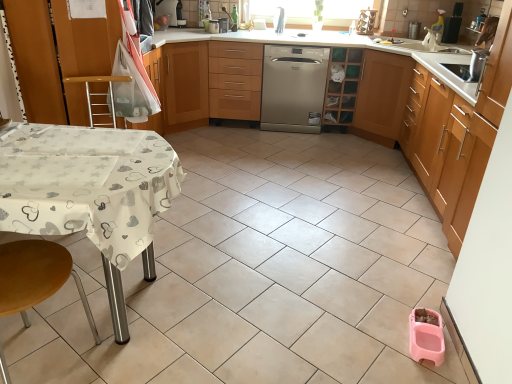
Describe the element at coordinates (98, 94) in the screenshot. The width and height of the screenshot is (512, 384). I see `wooden/metallic step stool at left, marked as the second step stool in a bottom-to-top arrangement` at that location.

Identify the location of white fabric-covered table at lower left. (x=90, y=193).

Find the location of a particular element. The height and width of the screenshot is (384, 512). brushed metal coffee machine at upper center, the first appliance positioned from the left is located at coordinates (168, 11).

This screenshot has height=384, width=512. Describe the element at coordinates (168, 11) in the screenshot. I see `brushed metal coffee machine at upper center, the first appliance positioned from the left` at that location.

You are a GUI agent. You are given a task and a screenshot of the screen. Output one action in this format:
    pyautogui.click(x=<x>, y=<y>)
    Task: Click on the wooden drawer at center
    The height and width of the screenshot is (384, 512).
    Given the screenshot: What is the action you would take?
    pyautogui.click(x=234, y=80)

Is metallic silver toaster at upper center, which appears as the 2th appliance when viewed from the right, smaller than brushed metal coffee machine at upper center, the first appliance positioned from the left?

Yes, metallic silver toaster at upper center, which appears as the 2th appliance when viewed from the right, is smaller than brushed metal coffee machine at upper center, the first appliance positioned from the left.

Who is taller, metallic silver toaster at upper center, the second appliance positioned from the left, or brushed metal coffee machine at upper center, the first appliance positioned from the left?

brushed metal coffee machine at upper center, the first appliance positioned from the left, is taller.

From the image's perspective, count 2nd appliances upward from the metallic silver toaster at upper center, which appears as the 2th appliance when viewed from the right, and point to it. Please provide its 2D coordinates.

[(168, 11)]

Is wooden cabinet at center, the 3th cabinetry when ordered from left to right, spatially inside metallic silver toaster at upper center, the second appliance positioned from the left, or outside of it?

wooden cabinet at center, the 3th cabinetry when ordered from left to right, is spatially situated outside metallic silver toaster at upper center, the second appliance positioned from the left.

Looking at this image, is wooden cabinet at center, the 3th cabinetry when ordered from left to right, oriented towards metallic silver toaster at upper center, the second appliance positioned from the left?

No, wooden cabinet at center, the 3th cabinetry when ordered from left to right, does not turn towards metallic silver toaster at upper center, the second appliance positioned from the left.

From a real-world perspective, is wooden cabinet at center, arranged as the 2th cabinetry when viewed from the right, positioned above or below metallic silver toaster at upper center, which appears as the 2th appliance when viewed from the right?

Clearly, from a real-world perspective, wooden cabinet at center, arranged as the 2th cabinetry when viewed from the right, is below metallic silver toaster at upper center, which appears as the 2th appliance when viewed from the right.

Measure the distance from wooden cabinet at center, the 3th cabinetry when ordered from left to right, to metallic silver toaster at upper center, which appears as the 2th appliance when viewed from the right.

wooden cabinet at center, the 3th cabinetry when ordered from left to right, is 4.33 feet from metallic silver toaster at upper center, which appears as the 2th appliance when viewed from the right.

Is white fabric-covered table at lower left closer to the viewer compared to wooden drawer at center?

Yes, white fabric-covered table at lower left is in front of wooden drawer at center.

From a real-world perspective, between white fabric-covered table at lower left and wooden drawer at center, who is vertically higher?

From a 3D spatial view, wooden drawer at center is above.

Could you tell me if white fabric-covered table at lower left is facing wooden drawer at center?

No.

From a real-world perspective, does wooden cabinet at upper center, the 2th cabinetry when ordered from left to right, stand above white fabric-covered table at lower left?

Yes, from a real-world perspective, wooden cabinet at upper center, the 2th cabinetry when ordered from left to right, is over white fabric-covered table at lower left

Which object is wider, wooden cabinet at upper center, the third cabinetry positioned from the right, or white fabric-covered table at lower left?

wooden cabinet at upper center, the third cabinetry positioned from the right, is wider.

Is the depth of wooden cabinet at upper center, the third cabinetry positioned from the right, greater than that of white fabric-covered table at lower left?

Yes, the depth of wooden cabinet at upper center, the third cabinetry positioned from the right, is greater than that of white fabric-covered table at lower left.

Is wooden cabinet at upper center, the 2th cabinetry when ordered from left to right, turned away from white fabric-covered table at lower left?

No.

From the picture: Considering the sizes of objects metallic silver spice rack at upper center, marked as the third appliance in a left-to-right arrangement, and light brown wood cabinet at right, placed as the 4th cabinetry when sorted from left to right, in the image provided, who is wider, metallic silver spice rack at upper center, marked as the third appliance in a left-to-right arrangement, or light brown wood cabinet at right, placed as the 4th cabinetry when sorted from left to right,?

light brown wood cabinet at right, placed as the 4th cabinetry when sorted from left to right, is wider.

Is metallic silver spice rack at upper center, marked as the third appliance in a left-to-right arrangement, situated inside light brown wood cabinet at right, placed as the 4th cabinetry when sorted from left to right, or outside?

metallic silver spice rack at upper center, marked as the third appliance in a left-to-right arrangement, is located beyond the bounds of light brown wood cabinet at right, placed as the 4th cabinetry when sorted from left to right.

Between metallic silver spice rack at upper center, the first appliance from the right, and light brown wood cabinet at right, marked as the first cabinetry in a right-to-left arrangement, which one has more height?

Standing taller between the two is light brown wood cabinet at right, marked as the first cabinetry in a right-to-left arrangement.

In the image, is metallic silver spice rack at upper center, marked as the third appliance in a left-to-right arrangement, on the left side or the right side of light brown wood cabinet at right, marked as the first cabinetry in a right-to-left arrangement?

metallic silver spice rack at upper center, marked as the third appliance in a left-to-right arrangement, is positioned on light brown wood cabinet at right, marked as the first cabinetry in a right-to-left arrangement,'s left side.

Is point (355, 85) positioned behind point (29, 26)?

Yes.

Considering the relative positions of wooden cabinet at center, arranged as the 2th cabinetry when viewed from the right, and white glossy table at left, the 4th cabinetry from the right, in the image provided, is wooden cabinet at center, arranged as the 2th cabinetry when viewed from the right, to the left of white glossy table at left, the 4th cabinetry from the right, from the viewer's perspective?

Incorrect, wooden cabinet at center, arranged as the 2th cabinetry when viewed from the right, is not on the left side of white glossy table at left, the 4th cabinetry from the right.

Where is `cabinetry above the wooden cabinet at center, arranged as the 2th cabinetry when viewed from the right (from a real-world perspective)`? The image size is (512, 384). cabinetry above the wooden cabinet at center, arranged as the 2th cabinetry when viewed from the right (from a real-world perspective) is located at coordinates (59, 55).

From a real-world perspective, is wooden cabinet at center, the 3th cabinetry when ordered from left to right, positioned under white glossy table at left, placed as the 1th cabinetry when sorted from left to right, based on gravity?

Indeed, from a real-world perspective, wooden cabinet at center, the 3th cabinetry when ordered from left to right, is positioned beneath white glossy table at left, placed as the 1th cabinetry when sorted from left to right.

Is metallic silver spice rack at upper center, marked as the third appliance in a left-to-right arrangement, situated inside brushed metal coffee machine at upper center, positioned as the 3th appliance in right-to-left order, or outside?

metallic silver spice rack at upper center, marked as the third appliance in a left-to-right arrangement, is spatially situated outside brushed metal coffee machine at upper center, positioned as the 3th appliance in right-to-left order.

Is brushed metal coffee machine at upper center, the first appliance positioned from the left, at the back of metallic silver spice rack at upper center, the first appliance from the right?

No, brushed metal coffee machine at upper center, the first appliance positioned from the left, is not at the back of metallic silver spice rack at upper center, the first appliance from the right.

Which of these two, metallic silver spice rack at upper center, marked as the third appliance in a left-to-right arrangement, or brushed metal coffee machine at upper center, positioned as the 3th appliance in right-to-left order, stands taller?

Standing taller between the two is brushed metal coffee machine at upper center, positioned as the 3th appliance in right-to-left order.

This screenshot has height=384, width=512. What are the coordinates of `appliance that is the 2nd object directly below the brushed metal coffee machine at upper center, positioned as the 3th appliance in right-to-left order (from a real-world perspective)` in the screenshot? It's located at (213, 26).

From the wooden cabinet at center, the 3th cabinetry when ordered from left to right, count the 1st appliance to the left and point to it. Please provide its 2D coordinates.

[(213, 26)]

Which object lies nearer to the anchor point white glossy table at left, the 4th cabinetry from the right, metallic silver spice rack at upper center, the first appliance from the right, or satin silver dishwasher at center?

satin silver dishwasher at center.

Looking at the image, which one is located further to metallic silver spice rack at upper center, the first appliance from the right, light brown wood cabinet at right, marked as the first cabinetry in a right-to-left arrangement, or white glossy table at left, the 4th cabinetry from the right?

white glossy table at left, the 4th cabinetry from the right, is further to metallic silver spice rack at upper center, the first appliance from the right.

Which object lies nearer to the anchor point wooden cabinet at upper center, the third cabinetry positioned from the right, wooden drawer at center or light brown wood cabinet at right, placed as the 4th cabinetry when sorted from left to right?

Based on the image, wooden drawer at center appears to be nearer to wooden cabinet at upper center, the third cabinetry positioned from the right.

Which object lies nearer to the anchor point brushed metal coffee machine at upper center, the first appliance positioned from the left, white glossy table at left, placed as the 1th cabinetry when sorted from left to right, or satin silver dishwasher at center?

satin silver dishwasher at center is closer to brushed metal coffee machine at upper center, the first appliance positioned from the left.

Based on their spatial positions, is white fabric-covered table at lower left or satin silver dishwasher at center further from wooden/metallic step stool at left, which ranks as the 1th step stool in top-to-bottom order?

Among the two, satin silver dishwasher at center is located further to wooden/metallic step stool at left, which ranks as the 1th step stool in top-to-bottom order.

Based on their spatial positions, is metallic silver spice rack at upper center, the first appliance from the right, or wooden drawer at center closer to satin silver dishwasher at center?

The object closer to satin silver dishwasher at center is wooden drawer at center.

Looking at the image, which one is located further to white fabric-covered table at lower left, brushed metal coffee machine at upper center, positioned as the 3th appliance in right-to-left order, or wooden step stool at lower left, placed as the 1th step stool when sorted from bottom to top?

Based on the image, brushed metal coffee machine at upper center, positioned as the 3th appliance in right-to-left order, appears to be further to white fabric-covered table at lower left.

Considering their positions, is metallic silver spice rack at upper center, the first appliance from the right, positioned closer to light brown wood cabinet at right, marked as the first cabinetry in a right-to-left arrangement, than satin silver dishwasher at center?

Among the two, satin silver dishwasher at center is located nearer to light brown wood cabinet at right, marked as the first cabinetry in a right-to-left arrangement.

Where is `step stool between white fabric-covered table at lower left and wooden cabinet at upper center, the third cabinetry positioned from the right, from front to back`? The image size is (512, 384). step stool between white fabric-covered table at lower left and wooden cabinet at upper center, the third cabinetry positioned from the right, from front to back is located at coordinates (98, 94).

At what (x,y) coordinates should I click in order to perform the action: click on drawer located between wooden/metallic step stool at left, acting as the second step stool starting from the front, and metallic silver toaster at upper center, which appears as the 2th appliance when viewed from the right, in the depth direction. Please return your answer as a coordinate pair (x, y). The image size is (512, 384). Looking at the image, I should click on (234, 80).

Identify the location of drawer located between white glossy table at left, placed as the 1th cabinetry when sorted from left to right, and metallic silver spice rack at upper center, marked as the third appliance in a left-to-right arrangement, in the left-right direction. This screenshot has height=384, width=512. (234, 80).

Find the location of a particular element. step stool positioned between white fabric-covered table at lower left and metallic silver toaster at upper center, the second appliance positioned from the left, from near to far is located at coordinates (98, 94).